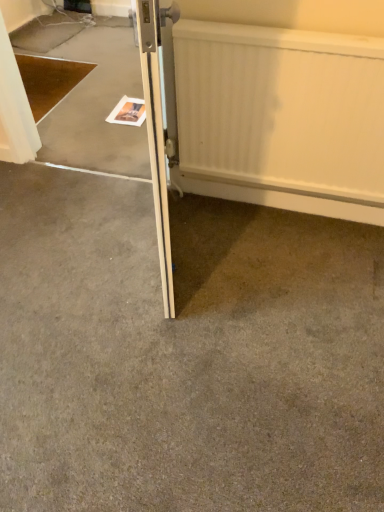
Question: From a real-world perspective, is wooden door at center located beneath white textured radiator at upper right?

Choices:
 (A) yes
 (B) no

Answer: (B)

Question: Is the position of wooden door at center less distant than that of white textured radiator at upper right?

Choices:
 (A) yes
 (B) no

Answer: (A)

Question: Is wooden door at center taller than white textured radiator at upper right?

Choices:
 (A) no
 (B) yes

Answer: (B)

Question: Does wooden door at center come behind white textured radiator at upper right?

Choices:
 (A) no
 (B) yes

Answer: (A)

Question: From the image's perspective, is wooden door at center on top of white textured radiator at upper right?

Choices:
 (A) yes
 (B) no

Answer: (B)

Question: In terms of height, does white textured radiator at upper right look taller or shorter compared to wooden door at center?

Choices:
 (A) short
 (B) tall

Answer: (A)

Question: From the image's perspective, is white textured radiator at upper right located above or below wooden door at center?

Choices:
 (A) above
 (B) below

Answer: (A)

Question: Is white textured radiator at upper right spatially inside wooden door at center, or outside of it?

Choices:
 (A) inside
 (B) outside

Answer: (B)

Question: From a real-world perspective, is white textured radiator at upper right above or below wooden door at center?

Choices:
 (A) above
 (B) below

Answer: (B)

Question: Is white textured radiator at upper right taller or shorter than gray carpet at center?

Choices:
 (A) tall
 (B) short

Answer: (A)

Question: Which is correct: white textured radiator at upper right is inside gray carpet at center, or outside of it?

Choices:
 (A) inside
 (B) outside

Answer: (B)

Question: From the image's perspective, is white textured radiator at upper right located above or below gray carpet at center?

Choices:
 (A) above
 (B) below

Answer: (A)

Question: Considering the positions of point (352, 214) and point (8, 231), is point (352, 214) closer or farther from the camera than point (8, 231)?

Choices:
 (A) closer
 (B) farther

Answer: (A)

Question: Considering the positions of point (372, 358) and point (145, 61), is point (372, 358) closer or farther from the camera than point (145, 61)?

Choices:
 (A) farther
 (B) closer

Answer: (A)

Question: Do you think gray carpet at center is within wooden door at center, or outside of it?

Choices:
 (A) inside
 (B) outside

Answer: (B)